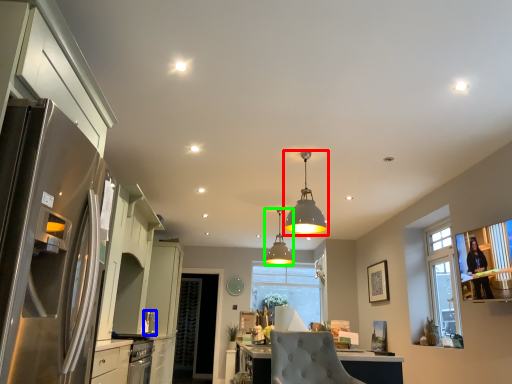
Question: Estimate the real-world distances between objects in this image. Which object is farther from lamp (highlighted by a red box), appliance (highlighted by a blue box) or lamp (highlighted by a green box)?

Choices:
 (A) appliance
 (B) lamp

Answer: (B)